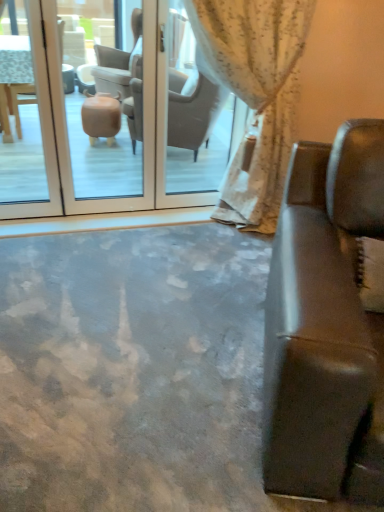
Question: Should I look upward or downward to see white floral fabric curtain at upper center?

Choices:
 (A) down
 (B) up

Answer: (B)

Question: Can you confirm if transparent glass door at center is positioned to the right of leather couch at right?

Choices:
 (A) no
 (B) yes

Answer: (A)

Question: From a real-world perspective, is transparent glass door at center beneath leather couch at right?

Choices:
 (A) no
 (B) yes

Answer: (A)

Question: Is transparent glass door at center bigger than leather couch at right?

Choices:
 (A) no
 (B) yes

Answer: (A)

Question: Does transparent glass door at center have a lesser width compared to leather couch at right?

Choices:
 (A) yes
 (B) no

Answer: (A)

Question: From a real-world perspective, does transparent glass door at center stand above leather couch at right?

Choices:
 (A) no
 (B) yes

Answer: (B)

Question: Does transparent glass door at center appear on the left side of leather couch at right?

Choices:
 (A) no
 (B) yes

Answer: (B)

Question: Is leather couch at right turned away from white floral fabric curtain at upper center?

Choices:
 (A) yes
 (B) no

Answer: (A)

Question: Is the position of leather couch at right less distant than that of white floral fabric curtain at upper center?

Choices:
 (A) no
 (B) yes

Answer: (B)

Question: Does leather couch at right have a lesser height compared to white floral fabric curtain at upper center?

Choices:
 (A) no
 (B) yes

Answer: (B)

Question: Can you confirm if leather couch at right is taller than white floral fabric curtain at upper center?

Choices:
 (A) yes
 (B) no

Answer: (B)

Question: Would you say white floral fabric curtain at upper center is part of leather couch at right's contents?

Choices:
 (A) no
 (B) yes

Answer: (A)

Question: Is leather couch at right next to white floral fabric curtain at upper center and touching it?

Choices:
 (A) no
 (B) yes

Answer: (A)

Question: Is white floral fabric curtain at upper center not inside transparent glass door at center?

Choices:
 (A) no
 (B) yes

Answer: (B)